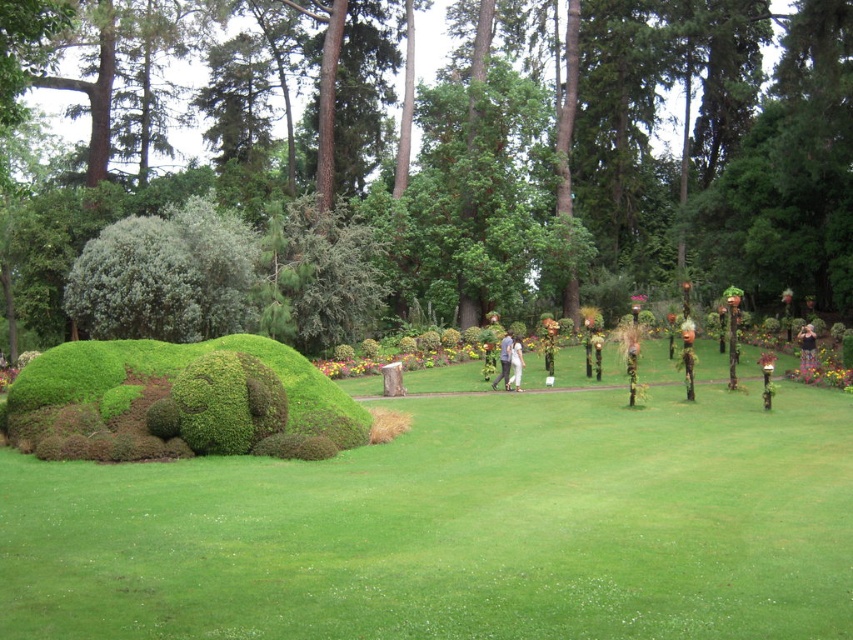
Question: Which of the following is the closest to the observer?

Choices:
 (A) (508, 381)
 (B) (71, 406)

Answer: (B)

Question: Does green leafy bush at center have a larger size compared to light blue jeans at center?

Choices:
 (A) yes
 (B) no

Answer: (A)

Question: Which of the following is the farthest from the observer?

Choices:
 (A) (810, 364)
 (B) (669, 550)
 (C) (6, 416)

Answer: (A)

Question: Which of these objects is positioned farthest from the green grass at center?

Choices:
 (A) white cotton pants at center
 (B) green bushy hedge at left

Answer: (A)

Question: Considering the relative positions of floral dress at center and white cotton pants at center in the image provided, where is floral dress at center located with respect to white cotton pants at center?

Choices:
 (A) above
 (B) below

Answer: (A)

Question: Can you confirm if green grass at center is positioned below white cotton pants at center?

Choices:
 (A) yes
 (B) no

Answer: (A)